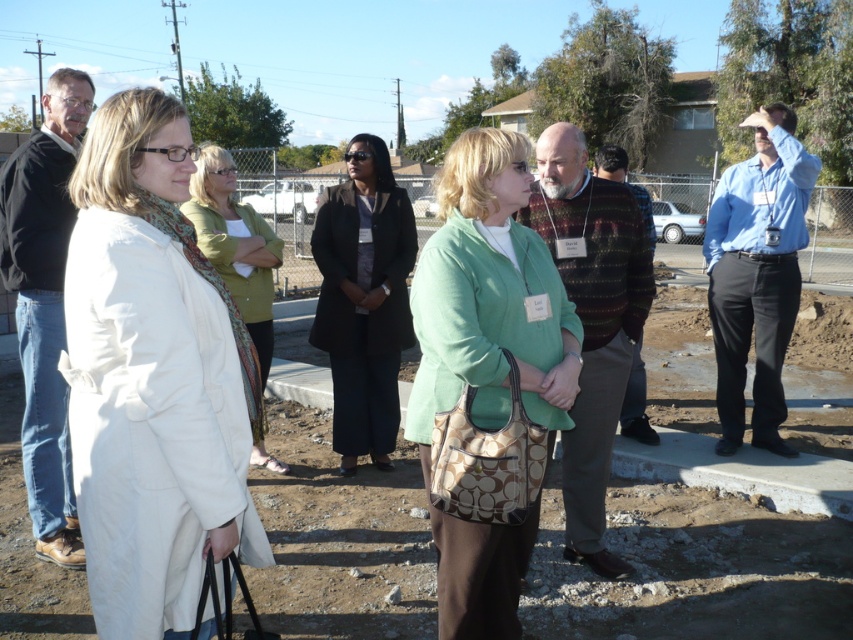
In the image, there is a white fabric coat at left and a point at (152, 378). Which object corresponds to the point?

The white fabric coat at left is represented by point (152, 378).